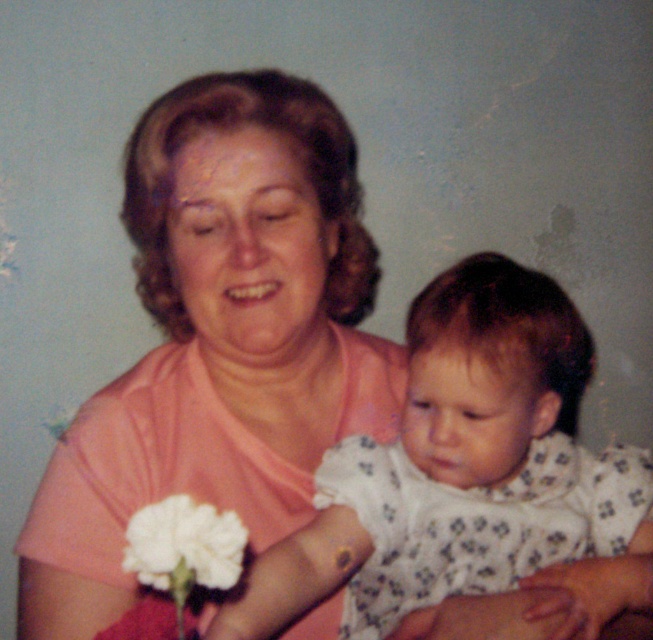
You are a fashion designer who wants to create a new outfit. You observe the white dotted dress at center and the white matte flower at lower left in the image. Which object is wider?

The white dotted dress at center is wider than the white matte flower at lower left.

You are a photographer trying to capture a closeup of the white dotted dress at center. Based on its coordinates, where should you focus your camera lens?

The white dotted dress at center is located at coordinates point (488,369), so the photographer should focus the camera lens at that point to capture a closeup.